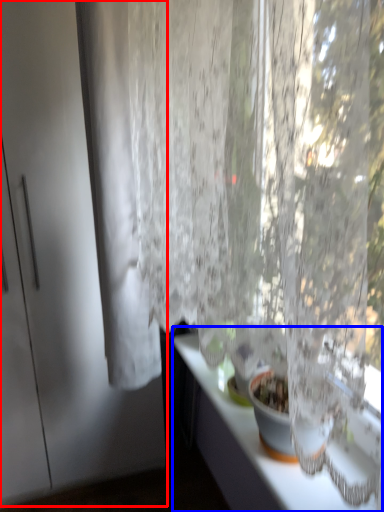
Question: Which object is further to the camera taking this photo, screen door (highlighted by a red box) or counter top (highlighted by a blue box)?

Choices:
 (A) screen door
 (B) counter top

Answer: (A)